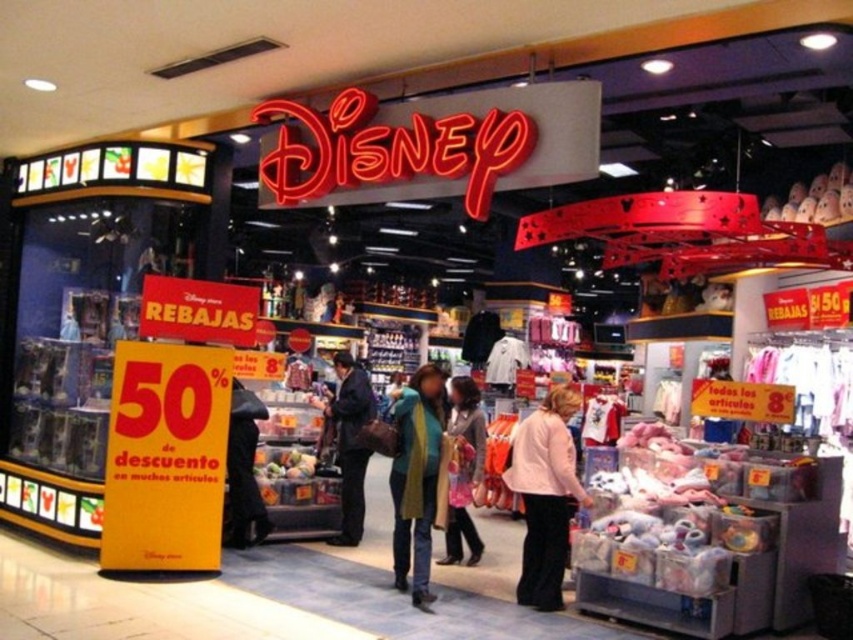
Is dark blue jeans at center to the right of light pink fabric jacket at center from the viewer's perspective?

No, dark blue jeans at center is not to the right of light pink fabric jacket at center.

Which is in front, point (354, 513) or point (479, 556)?

Point (479, 556) is in front.

The height and width of the screenshot is (640, 853). I want to click on dark blue jeans at center, so click(350, 442).

Is green knitted scarf at center bigger than dark blue jeans at center?

Incorrect, green knitted scarf at center is not larger than dark blue jeans at center.

Between point (415, 451) and point (337, 424), which one is positioned behind?

The point (337, 424) is behind.

Identify the location of green knitted scarf at center. (416, 480).

Does pink fabric jacket at lower center come in front of dark blue jeans at center?

Yes, pink fabric jacket at lower center is in front of dark blue jeans at center.

Is pink fabric jacket at lower center taller than dark blue jeans at center?

No.

Find the location of a particular element. pink fabric jacket at lower center is located at coordinates (544, 496).